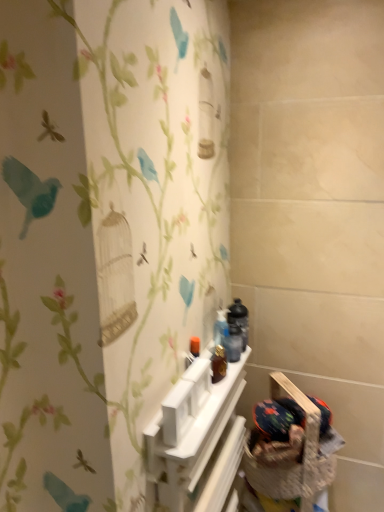
Question: Is fluffy fabric basket at lower right thinner than white plastic shelf at center?

Choices:
 (A) yes
 (B) no

Answer: (B)

Question: Is fluffy fabric basket at lower right in contact with white plastic shelf at center?

Choices:
 (A) no
 (B) yes

Answer: (A)

Question: From a real-world perspective, is fluffy fabric basket at lower right on top of white plastic shelf at center?

Choices:
 (A) yes
 (B) no

Answer: (A)

Question: Considering the relative sizes of fluffy fabric basket at lower right and white plastic shelf at center in the image provided, is fluffy fabric basket at lower right wider than white plastic shelf at center?

Choices:
 (A) yes
 (B) no

Answer: (A)

Question: Does fluffy fabric basket at lower right have a greater height compared to white plastic shelf at center?

Choices:
 (A) no
 (B) yes

Answer: (A)

Question: From the image's perspective, is fluffy fabric basket at lower right above white plastic shelf at center?

Choices:
 (A) yes
 (B) no

Answer: (A)

Question: Is white plastic shelf at center bigger than fluffy fabric basket at lower right?

Choices:
 (A) no
 (B) yes

Answer: (B)

Question: Is the surface of white plastic shelf at center in direct contact with fluffy fabric basket at lower right?

Choices:
 (A) no
 (B) yes

Answer: (A)

Question: Is fluffy fabric basket at lower right a part of white plastic shelf at center?

Choices:
 (A) no
 (B) yes

Answer: (A)

Question: Does white plastic shelf at center lie in front of fluffy fabric basket at lower right?

Choices:
 (A) yes
 (B) no

Answer: (A)

Question: Does white plastic shelf at center appear on the left side of fluffy fabric basket at lower right?

Choices:
 (A) no
 (B) yes

Answer: (B)

Question: Is white plastic shelf at center to the right of fluffy fabric basket at lower right from the viewer's perspective?

Choices:
 (A) no
 (B) yes

Answer: (A)

Question: Based on their sizes in the image, would you say fluffy fabric basket at lower right is bigger or smaller than white plastic shelf at center?

Choices:
 (A) small
 (B) big

Answer: (A)